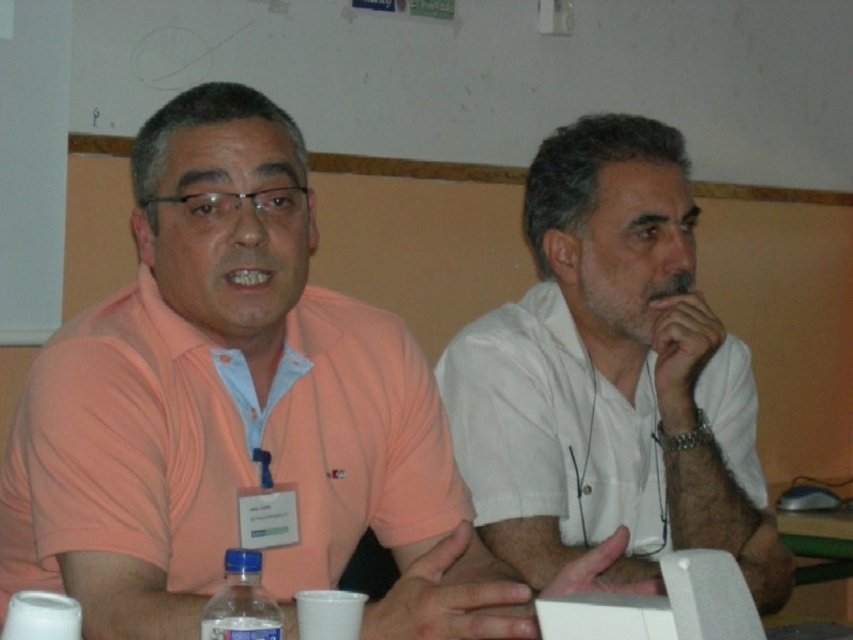
You are sitting at the table and want to reach for the transparent plastic bottle at lower left. Is it located in front of or behind the green plastic table at lower right?

The transparent plastic bottle at lower left is behind the green plastic table at lower right, so it is located behind the table.

You are a photographer setting up for a group photo. You need to position yourself so that both the matte orange shirt at center and the white matte shirt at center are in focus. Which shirt should you focus on to ensure both are sharp?

You should focus on the matte orange shirt at center because it is closer to the viewer, ensuring both it and the white matte shirt at center will be in focus.

You are organizing a clothing display and need to arrange the matte orange shirt at center and the white matte shirt at center side by side. Based on their widths, which shirt should be placed on the left to ensure they fit within the display area?

The matte orange shirt at center might be wider than the white matte shirt at center, so placing the wider matte orange shirt at center on the left would ensure both shirts fit within the display area.